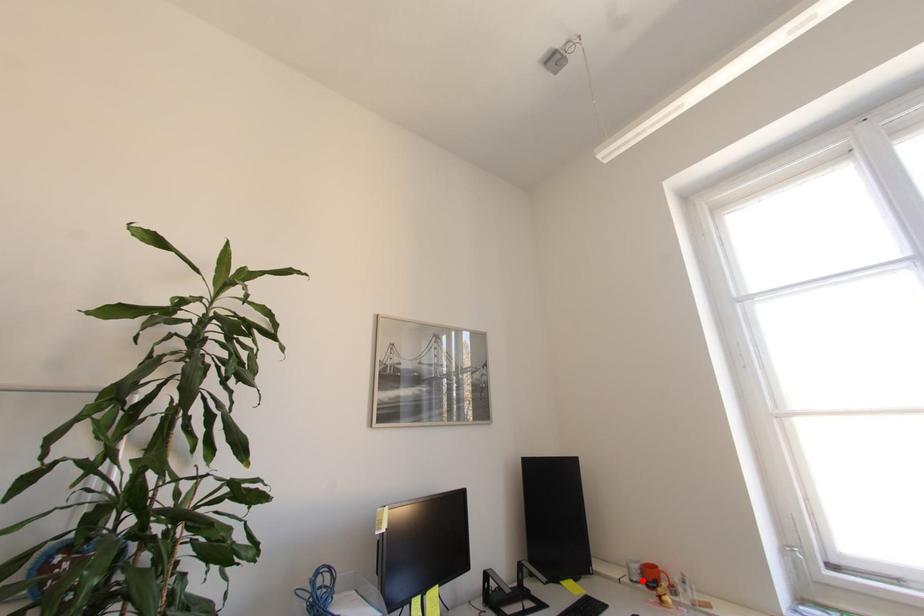
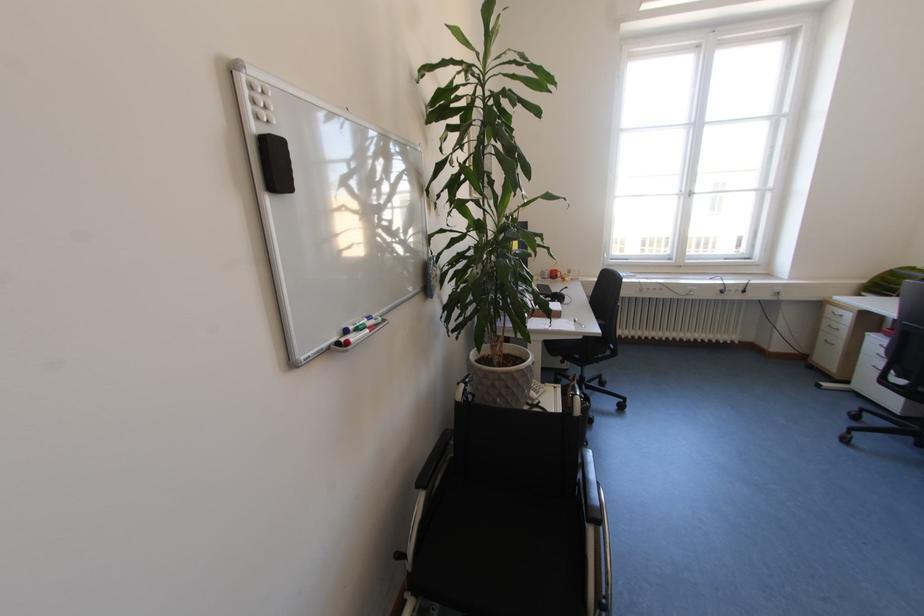
Where in the second image is the point corresponding to the highlighted location from the first image?

(553, 278)